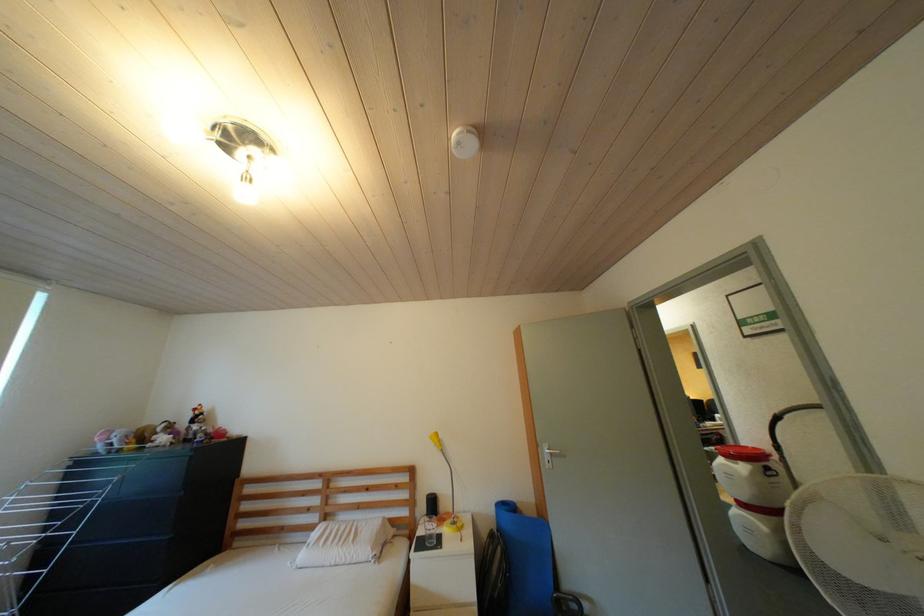
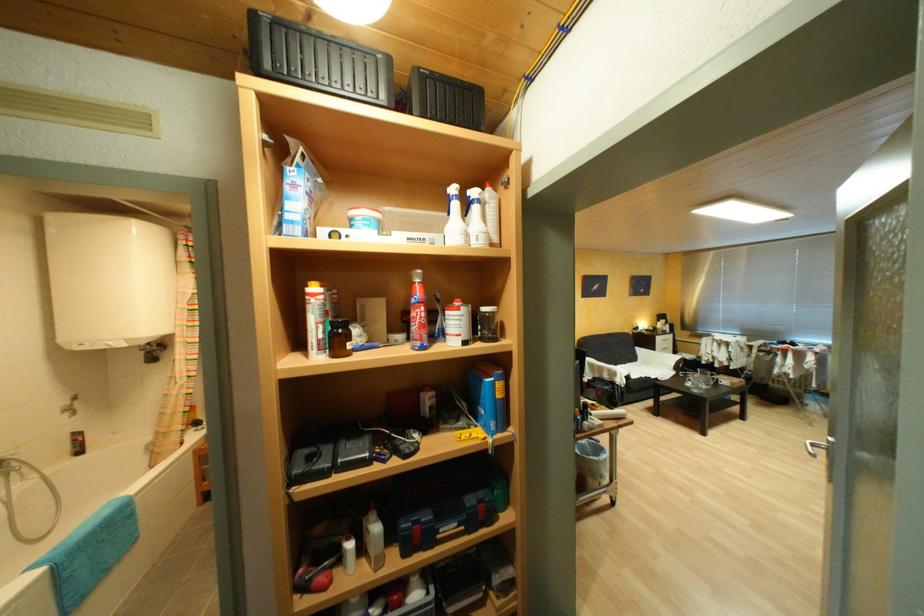
In a continuous first-person perspective shot, in which direction is the camera moving?

The movement direction of the cameraman is right, forward.